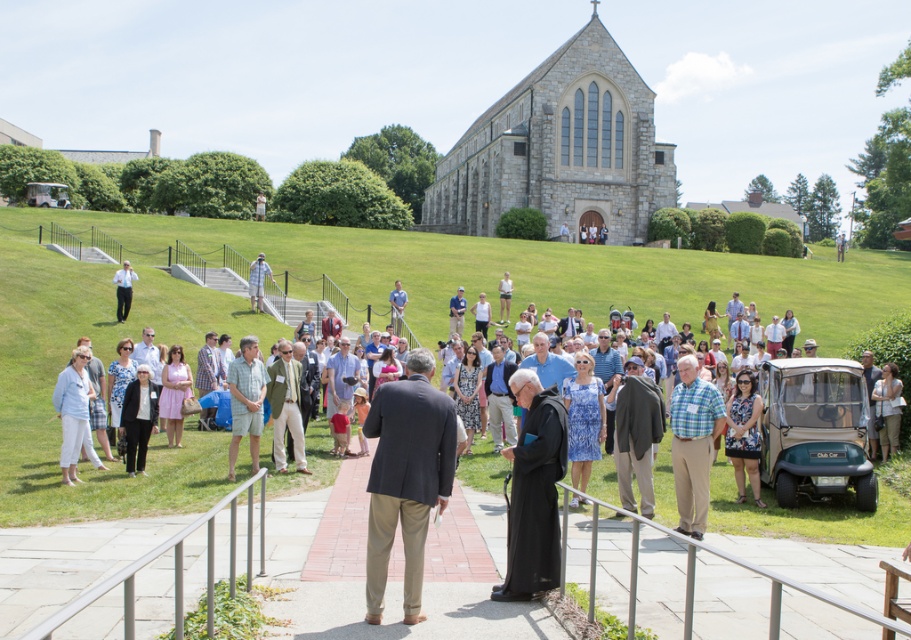
Question: Observing the image, what is the correct spatial positioning of plaid shirt at center in reference to light blue shirt at center?

Choices:
 (A) left
 (B) right

Answer: (B)

Question: Is dark gray suit at center further to camera compared to white plastic golf cart at center?

Choices:
 (A) yes
 (B) no

Answer: (B)

Question: Among these points, which one is nearest to the camera?

Choices:
 (A) (46, 198)
 (B) (879, 372)

Answer: (B)

Question: Which point appears closest to the camera in this image?

Choices:
 (A) (869, 456)
 (B) (628, 476)
 (C) (693, 356)

Answer: (B)

Question: Is light blue denim shorts at center wider than white cotton dress at center?

Choices:
 (A) no
 (B) yes

Answer: (B)

Question: Which object is closer to the camera taking this photo?

Choices:
 (A) blue shirt at center
 (B) dark gray suit at center

Answer: (B)